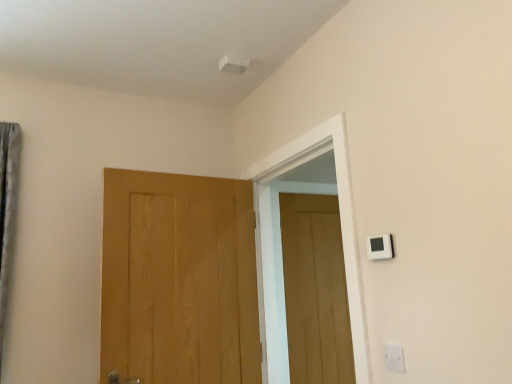
This screenshot has height=384, width=512. In order to click on white plastic electric outlet at lower right in this screenshot , I will do `click(394, 358)`.

Describe the element at coordinates (380, 247) in the screenshot. I see `white plastic light switch at upper right` at that location.

I want to click on light brown wood door at center, which appears as the first door when viewed from the left, so click(x=179, y=279).

Considering the relative positions of white plastic electric outlet at lower right and wooden door at center, the 1th door in the right-to-left sequence, in the image provided, is white plastic electric outlet at lower right to the left of wooden door at center, the 1th door in the right-to-left sequence, from the viewer's perspective?

No, white plastic electric outlet at lower right is not to the left of wooden door at center, the 1th door in the right-to-left sequence.

Locate an element on the screen. Image resolution: width=512 pixels, height=384 pixels. the 2nd door behind the white plastic electric outlet at lower right is located at coordinates (315, 290).

Considering the sizes of objects white plastic electric outlet at lower right and wooden door at center, the 1th door in the right-to-left sequence, in the image provided, who is shorter, white plastic electric outlet at lower right or wooden door at center, the 1th door in the right-to-left sequence,?

white plastic electric outlet at lower right.

Which of these two, white plastic electric outlet at lower right or wooden door at center, the first door positioned from the back, is smaller?

white plastic electric outlet at lower right.

In terms of width, does light brown wood door at center, the second door from the back, look wider or thinner when compared to white plastic electric outlet at lower right?

Considering their sizes, light brown wood door at center, the second door from the back, looks broader than white plastic electric outlet at lower right.

How many degrees apart are the facing directions of light brown wood door at center, which appears as the first door when viewed from the left, and white plastic electric outlet at lower right?

The angle between the facing direction of light brown wood door at center, which appears as the first door when viewed from the left, and the facing direction of white plastic electric outlet at lower right is 94.8 degrees.

In the scene shown: Considering the relative positions of light brown wood door at center, which is the second door from right to left, and white plastic electric outlet at lower right in the image provided, is light brown wood door at center, which is the second door from right to left, to the left or to the right of white plastic electric outlet at lower right?

Based on their positions, light brown wood door at center, which is the second door from right to left, is located to the left of white plastic electric outlet at lower right.

Is light brown wood door at center, the 1th door viewed from the front, next to white plastic electric outlet at lower right?

No, light brown wood door at center, the 1th door viewed from the front, is not touching white plastic electric outlet at lower right.

Find the location of a particular element. This screenshot has width=512, height=384. door that appears on the right of light brown wood door at center, which appears as the first door when viewed from the left is located at coordinates 315,290.

Considering the relative sizes of wooden door at center, the second door in the front-to-back sequence, and light brown wood door at center, which appears as the first door when viewed from the left, in the image provided, is wooden door at center, the second door in the front-to-back sequence, taller than light brown wood door at center, which appears as the first door when viewed from the left,?

Yes.

Which object is positioned more to the left, wooden door at center, the second door in the front-to-back sequence, or light brown wood door at center, which appears as the first door when viewed from the left?

Positioned to the left is light brown wood door at center, which appears as the first door when viewed from the left.

Is white plastic light switch at upper right facing towards wooden door at center, the 1th door in the right-to-left sequence?

No, white plastic light switch at upper right is not turned towards wooden door at center, the 1th door in the right-to-left sequence.

Which of these two, white plastic light switch at upper right or wooden door at center, the second door in the front-to-back sequence, is wider?

wooden door at center, the second door in the front-to-back sequence, is wider.

From the image's perspective, is white plastic light switch at upper right on wooden door at center, which is the second door from left to right?

Yes, from the image's perspective, white plastic light switch at upper right is on top of wooden door at center, which is the second door from left to right.

Find the location of a particular element. light switch above the wooden door at center, the second door in the front-to-back sequence (from the image's perspective) is located at coordinates (380, 247).

Is white plastic light switch at upper right next to white plastic electric outlet at lower right?

They are not placed beside each other.

Is white plastic light switch at upper right taller than white plastic electric outlet at lower right?

No.

The height and width of the screenshot is (384, 512). Find the location of `light switch on the left of the white plastic electric outlet at lower right`. light switch on the left of the white plastic electric outlet at lower right is located at coordinates (380, 247).

Based on the photo, how far apart are white plastic light switch at upper right and white plastic electric outlet at lower right?

They are 13.15 inches apart.

Which is more to the left, light brown wood door at center, which appears as the first door when viewed from the left, or wooden door at center, the first door positioned from the back?

light brown wood door at center, which appears as the first door when viewed from the left, is more to the left.

The height and width of the screenshot is (384, 512). In order to click on door that appears above the wooden door at center, the second door in the front-to-back sequence (from the image's perspective) in this screenshot , I will do `click(179, 279)`.

Is light brown wood door at center, the second door from the back, bigger than wooden door at center, the 1th door in the right-to-left sequence?

Yes.

Considering the sizes of objects white plastic light switch at upper right and light brown wood door at center, which appears as the first door when viewed from the left, in the image provided, who is shorter, white plastic light switch at upper right or light brown wood door at center, which appears as the first door when viewed from the left,?

Standing shorter between the two is white plastic light switch at upper right.

Considering the relative sizes of white plastic light switch at upper right and light brown wood door at center, which is the second door from right to left, in the image provided, is white plastic light switch at upper right wider than light brown wood door at center, which is the second door from right to left,?

No, white plastic light switch at upper right is not wider than light brown wood door at center, which is the second door from right to left.

Considering the positions of objects white plastic light switch at upper right and light brown wood door at center, which is the second door from right to left, in the image provided, who is in front, white plastic light switch at upper right or light brown wood door at center, which is the second door from right to left,?

white plastic light switch at upper right.

Measure the distance from white plastic light switch at upper right to light brown wood door at center, the second door from the back.

white plastic light switch at upper right and light brown wood door at center, the second door from the back, are 1.07 meters apart from each other.

This screenshot has width=512, height=384. I want to click on electric outlet located above the wooden door at center, the first door positioned from the back (from the image's perspective), so click(x=394, y=358).

Where is `electric outlet that is under the light brown wood door at center, which is the second door from right to left (from a real-world perspective)`? This screenshot has height=384, width=512. electric outlet that is under the light brown wood door at center, which is the second door from right to left (from a real-world perspective) is located at coordinates (394, 358).

Considering their positions, is white plastic electric outlet at lower right positioned further to wooden door at center, the first door positioned from the back, than white plastic light switch at upper right?

white plastic electric outlet at lower right lies further to wooden door at center, the first door positioned from the back, than the other object.

From the image, which object appears to be nearer to light brown wood door at center, which is the second door from right to left, white plastic electric outlet at lower right or white plastic light switch at upper right?

Based on the image, white plastic light switch at upper right appears to be nearer to light brown wood door at center, which is the second door from right to left.

Looking at this image, from the image, which object appears to be nearer to light brown wood door at center, which is the second door from right to left, wooden door at center, the first door positioned from the back, or white plastic light switch at upper right?

wooden door at center, the first door positioned from the back.

Considering their positions, is white plastic light switch at upper right positioned further to light brown wood door at center, which is the second door from right to left, than white plastic electric outlet at lower right?

white plastic electric outlet at lower right.

Based on their spatial positions, is wooden door at center, the second door in the front-to-back sequence, or light brown wood door at center, which appears as the first door when viewed from the left, further from white plastic light switch at upper right?

Based on the image, wooden door at center, the second door in the front-to-back sequence, appears to be further to white plastic light switch at upper right.

Considering their positions, is wooden door at center, the second door in the front-to-back sequence, positioned closer to white plastic electric outlet at lower right than white plastic light switch at upper right?

Among the two, white plastic light switch at upper right is located nearer to white plastic electric outlet at lower right.

Looking at the image, which one is located further to light brown wood door at center, the 1th door viewed from the front, wooden door at center, which is the second door from left to right, or white plastic electric outlet at lower right?

Among the two, white plastic electric outlet at lower right is located further to light brown wood door at center, the 1th door viewed from the front.

Estimate the real-world distances between objects in this image. Which object is closer to white plastic light switch at upper right, white plastic electric outlet at lower right or light brown wood door at center, the second door from the back?

Based on the image, white plastic electric outlet at lower right appears to be nearer to white plastic light switch at upper right.

This screenshot has width=512, height=384. In order to click on door between white plastic light switch at upper right and wooden door at center, the 1th door in the right-to-left sequence, in the front-back direction in this screenshot , I will do `click(179, 279)`.

The height and width of the screenshot is (384, 512). I want to click on door positioned between white plastic electric outlet at lower right and wooden door at center, which is the second door from left to right, from near to far, so click(179, 279).

You are a GUI agent. You are given a task and a screenshot of the screen. Output one action in this format:
    pyautogui.click(x=<x>, y=<y>)
    Task: Click on the light switch between white plastic electric outlet at lower right and wooden door at center, the first door positioned from the back, in the front-back direction
    
    Given the screenshot: What is the action you would take?
    pyautogui.click(x=380, y=247)

I want to click on light switch between light brown wood door at center, the second door from the back, and white plastic electric outlet at lower right, so click(380, 247).